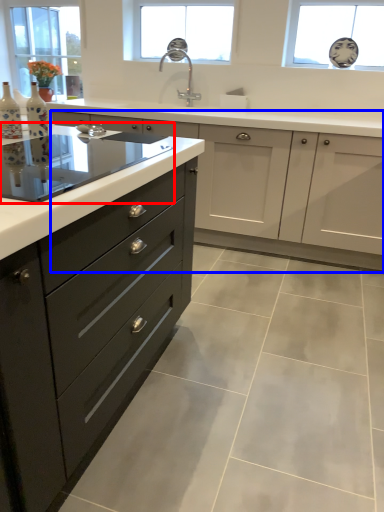
Question: Which point is further to the camera, home appliance (highlighted by a red box) or cabinetry (highlighted by a blue box)?

Choices:
 (A) home appliance
 (B) cabinetry

Answer: (B)